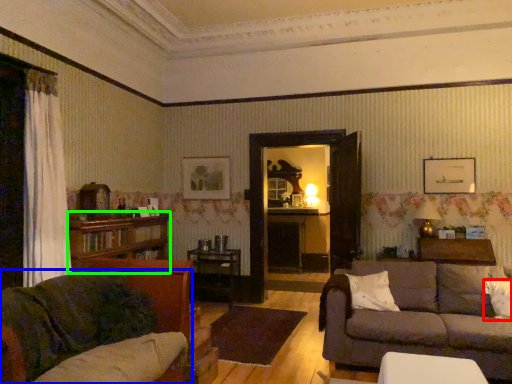
Question: Considering the real-world distances, which object is farthest from pillow (highlighted by a red box)? studio couch (highlighted by a blue box) or bookcase (highlighted by a green box)?

Choices:
 (A) studio couch
 (B) bookcase

Answer: (B)